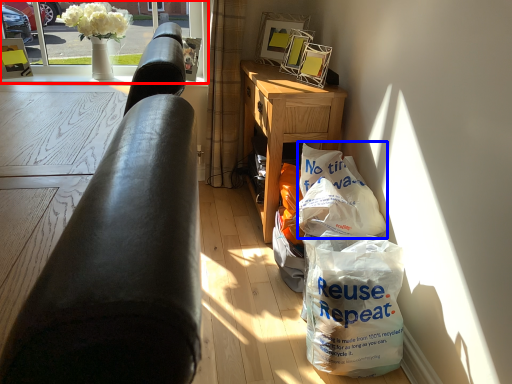
Question: Which object is closer to the camera taking this photo, window screen (highlighted by a red box) or grocery bag (highlighted by a blue box)?

Choices:
 (A) window screen
 (B) grocery bag

Answer: (B)